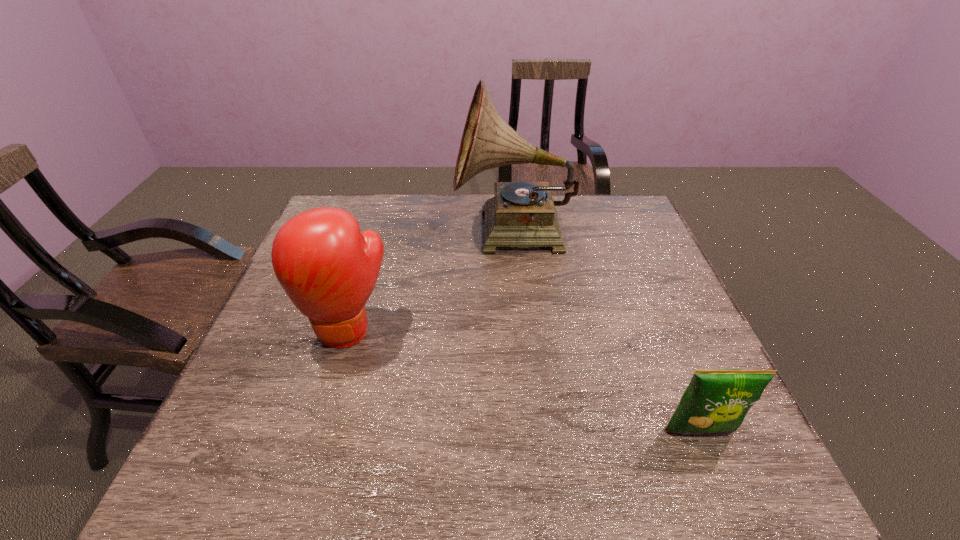
This screenshot has width=960, height=540. Find the location of `record player`. record player is located at coordinates (521, 214).

Locate an element on the screen. The image size is (960, 540). the second object from left to right is located at coordinates (521, 214).

Find the location of a particular element. This screenshot has height=540, width=960. the second tallest object is located at coordinates (328, 269).

Image resolution: width=960 pixels, height=540 pixels. Find the location of `boxing glove`. boxing glove is located at coordinates (x=328, y=269).

Locate an element on the screen. The image size is (960, 540). the rightmost object is located at coordinates (715, 400).

This screenshot has height=540, width=960. I want to click on the nearest object, so click(715, 400).

This screenshot has width=960, height=540. In order to click on vacant space situated from the horn of the tallest object in this screenshot , I will do `click(361, 233)`.

Identify the location of vacant space located from the horn of the tallest object. Image resolution: width=960 pixels, height=540 pixels. (439, 233).

The image size is (960, 540). What are the coordinates of `vacant space located from the horn of the tallest object` in the screenshot? It's located at (390, 233).

You are a GUI agent. You are given a task and a screenshot of the screen. Output one action in this format:
    pyautogui.click(x=<x>, y=<y>)
    Task: Click on the vacant area situated 0.290m on the striking surface of the second shortest object
    This screenshot has width=960, height=540.
    Given the screenshot: What is the action you would take?
    pyautogui.click(x=300, y=494)